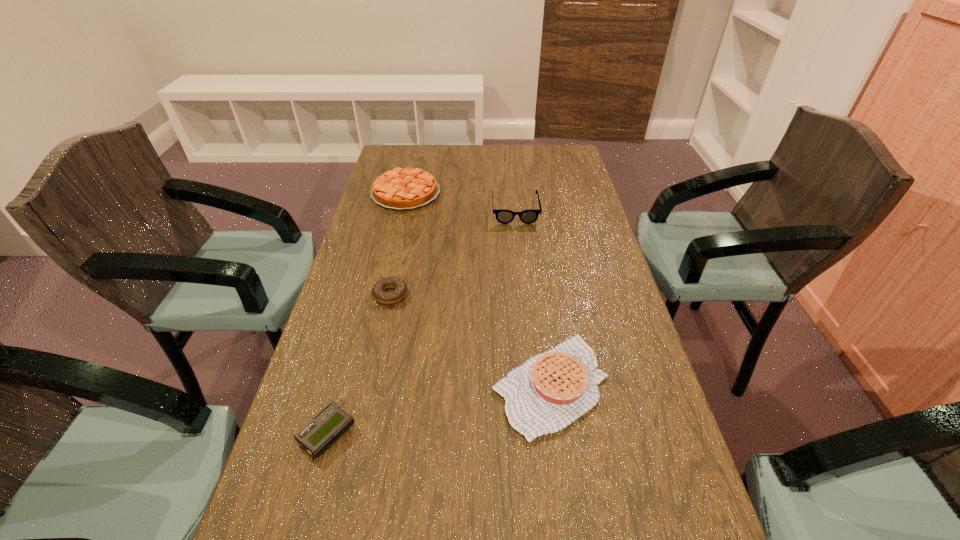
Find the location of a particular element. The image size is (960, 540). vacant region between the third nearest object and the farther pie is located at coordinates (398, 244).

Where is `empty space between the right pie and the doughnut`? Image resolution: width=960 pixels, height=540 pixels. empty space between the right pie and the doughnut is located at coordinates (470, 340).

Where is `vacant space that's between the spectacles and the nearer pie`? This screenshot has width=960, height=540. vacant space that's between the spectacles and the nearer pie is located at coordinates (533, 298).

Where is `vacant space in between the nearer pie and the doughnut`? vacant space in between the nearer pie and the doughnut is located at coordinates (470, 340).

Identify the location of vacant space that is in between the left pie and the right pie. The height and width of the screenshot is (540, 960). (478, 289).

At what (x,y) coordinates should I click in order to perform the action: click on free space between the third farthest object and the spectacles. Please return your answer as a coordinate pair (x, y). Looking at the image, I should click on (453, 252).

Locate an element on the screen. Image resolution: width=960 pixels, height=540 pixels. unoccupied area between the spectacles and the third farthest object is located at coordinates (453, 252).

Identify the location of free space between the third farthest object and the nearer pie. This screenshot has width=960, height=540. (470, 340).

The height and width of the screenshot is (540, 960). In order to click on the third closest object to the doughnut in this screenshot , I will do `click(407, 188)`.

Image resolution: width=960 pixels, height=540 pixels. Identify the location of object that ranks as the closest to the tallest object. (407, 188).